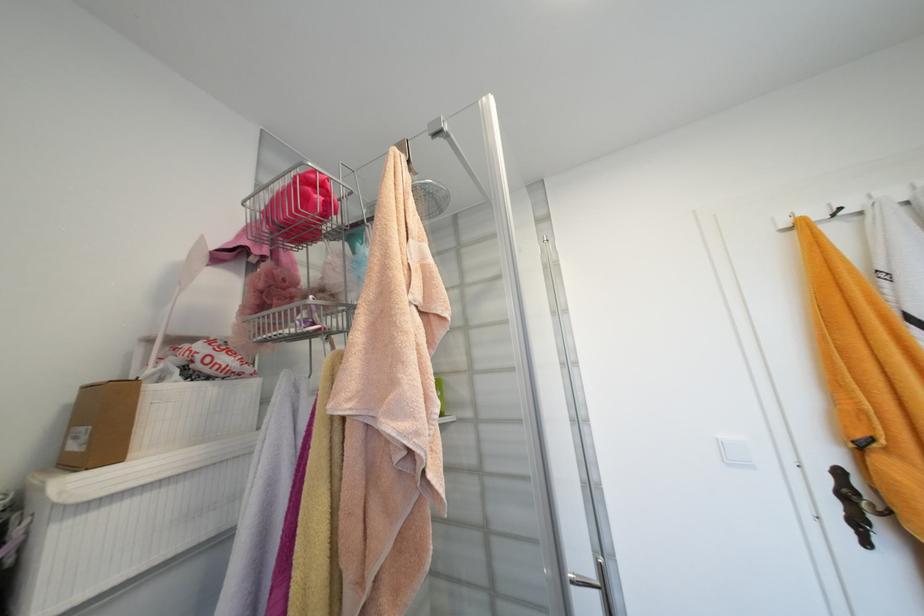
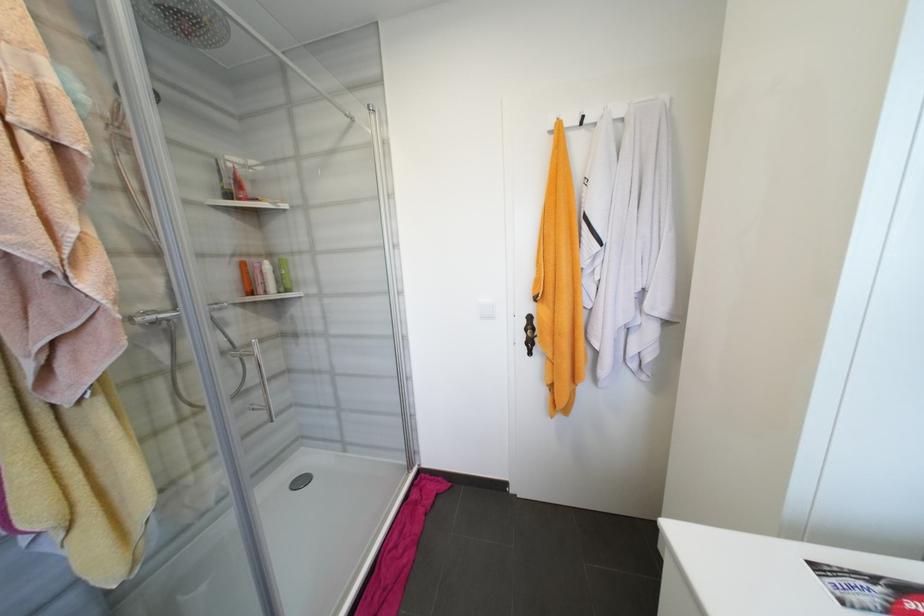
The images are taken continuously from a first-person perspective. In which direction are you moving?

The cameraman moved toward right, backward.